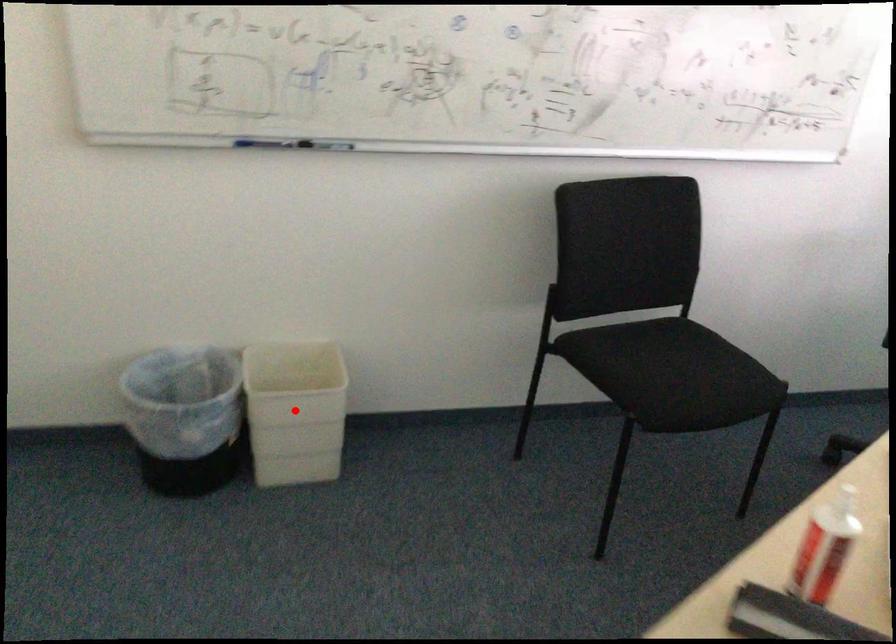
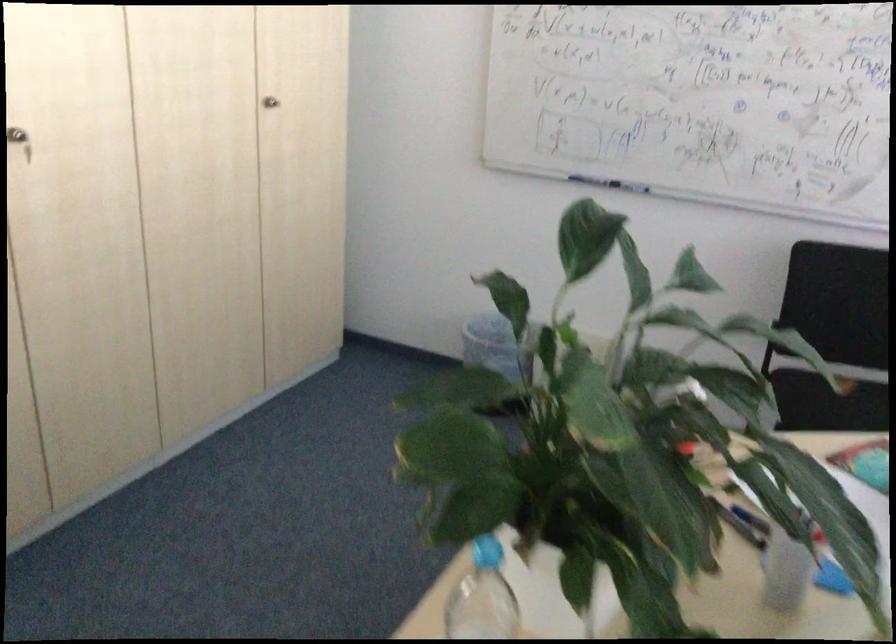
Question: I am providing you with two images of the same scene from different viewpoints. A red point is marked on the first image. At the location where the point appears in image 1, is it still visible in image 2?

Choices:
 (A) Yes
 (B) No

Answer: (B)